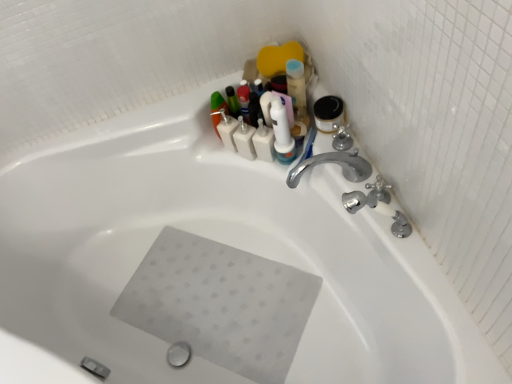
Question: Is point (384, 193) positioned closer to the camera than point (410, 233)?

Choices:
 (A) farther
 (B) closer

Answer: (A)

Question: In the image, is satin nickel faucet at upper right, which is the 2th plumbing fixture from front to back, on the left side or the right side of silver metallic faucet at upper right, which ranks as the first plumbing fixture in front-to-back order?

Choices:
 (A) right
 (B) left

Answer: (A)

Question: Which of these objects is positioned farthest from the satin nickel faucet at upper right, which is the 2th plumbing fixture from front to back?

Choices:
 (A) white plastic toothbrush at upper center, the 2th toiletry when ordered from left to right
 (B) white matte bottles at upper center, marked as the first toiletry in a left-to-right arrangement
 (C) silver metallic faucet at upper right, which ranks as the first plumbing fixture in front-to-back order

Answer: (B)

Question: Which is nearer to the white matte bottles at upper center, which appears as the 2th toiletry when viewed from the right?

Choices:
 (A) silver metallic faucet at upper right, which ranks as the first plumbing fixture in front-to-back order
 (B) white plastic toothbrush at upper center, the 2th toiletry when ordered from left to right
 (C) satin nickel faucet at upper right, which is the 2th plumbing fixture from front to back

Answer: (B)